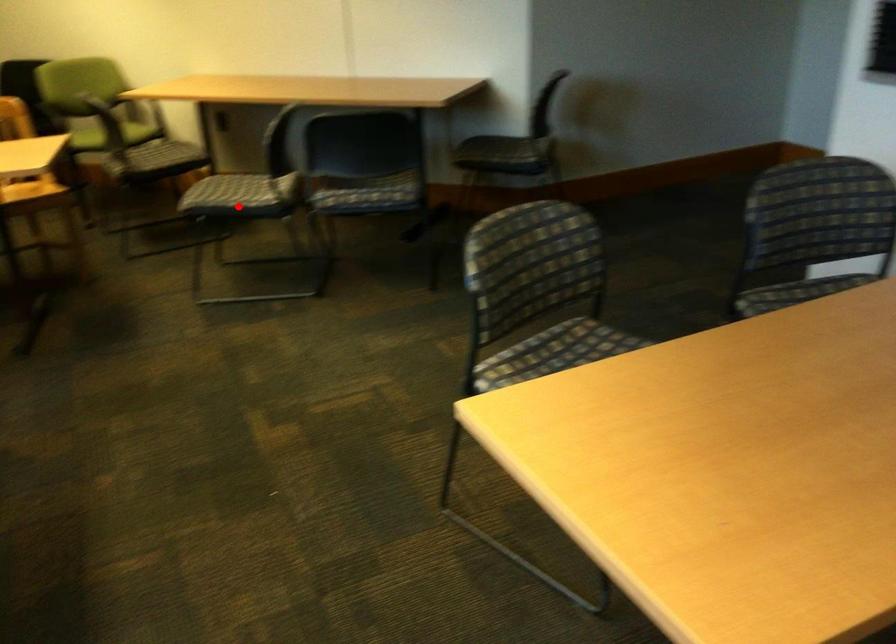
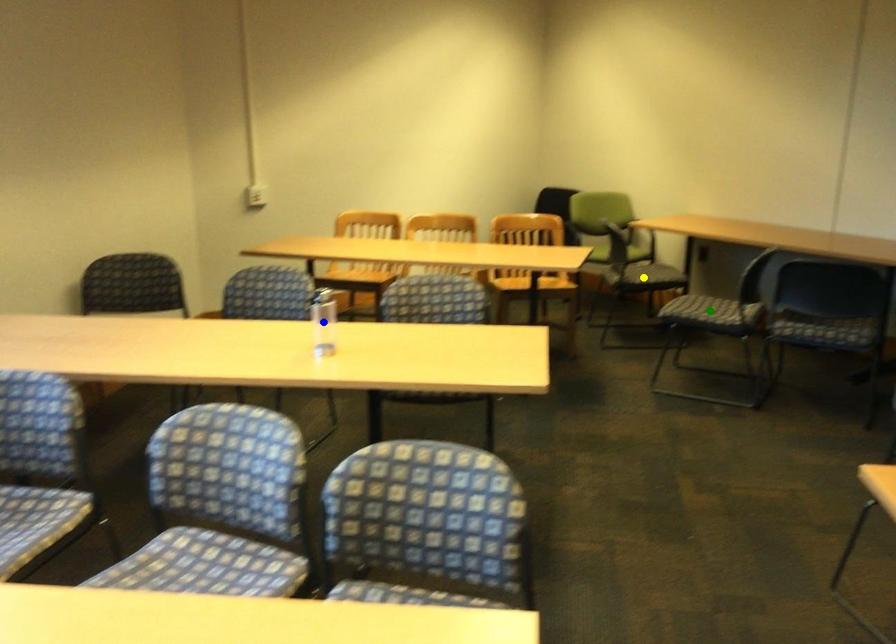
Question: I am providing you with two images of the same scene from different viewpoints. A red point is marked on the first image. You are given multiple points on the second image. Can you choose the point in image 2 that corresponds to the point in image 1?

Choices:
 (A) blue point
 (B) green point
 (C) yellow point

Answer: (B)